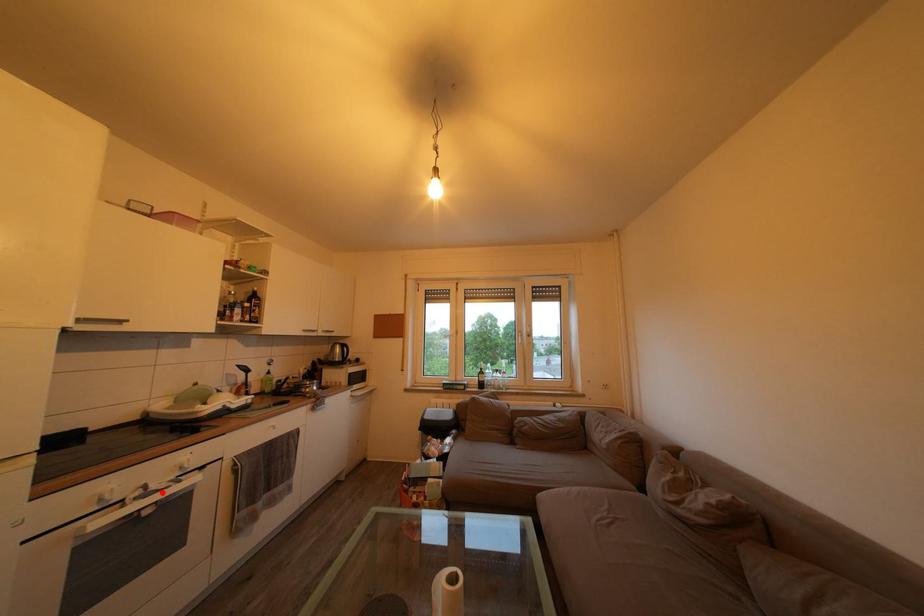
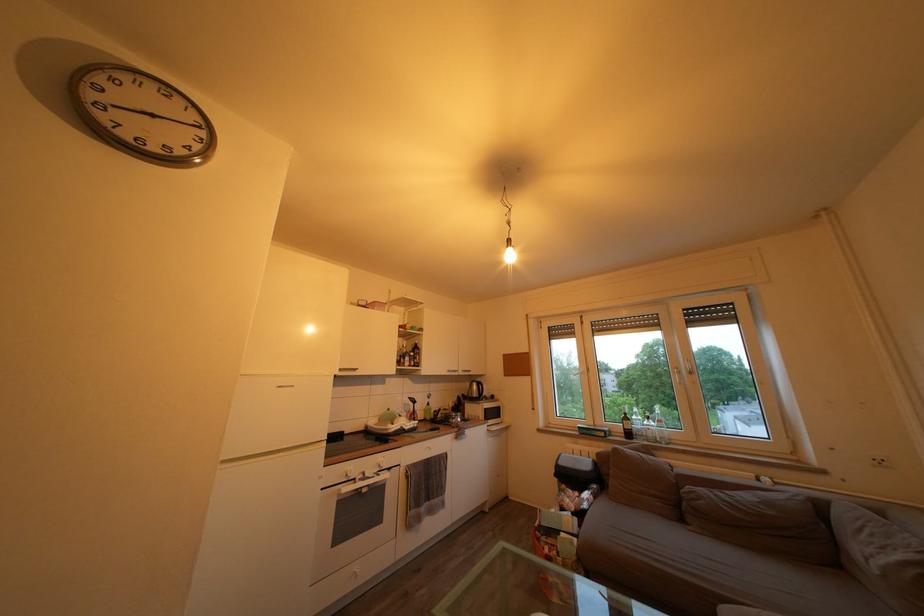
Question: I am providing you with two images of the same scene from different viewpoints. Image1 has a red point marked. In image2, the corresponding 3D location appears at what relative position? Reply with the corresponding letter.

Choices:
 (A) Closer
 (B) Farther

Answer: (B)